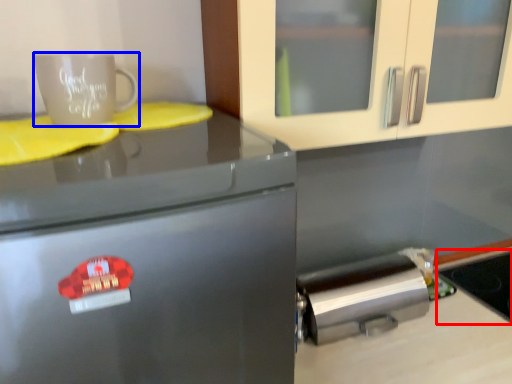
Question: Which object appears closest to the camera in this image, appliance (highlighted by a red box) or coffee cup (highlighted by a blue box)?

Choices:
 (A) appliance
 (B) coffee cup

Answer: (B)